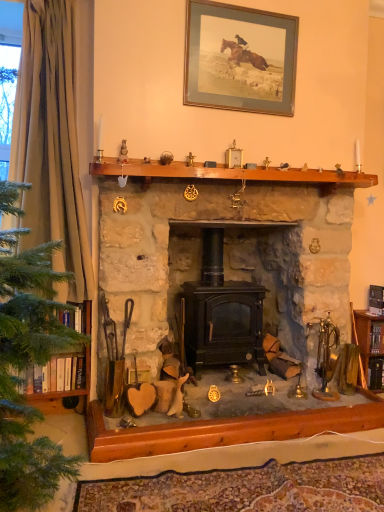
Question: Is green fabric curtain at left next to brown wooden mantle at upper center?

Choices:
 (A) no
 (B) yes

Answer: (A)

Question: Is green fabric curtain at left to the left of brown wooden mantle at upper center from the viewer's perspective?

Choices:
 (A) no
 (B) yes

Answer: (B)

Question: Considering the relative positions of green fabric curtain at left and brown wooden mantle at upper center in the image provided, is green fabric curtain at left behind brown wooden mantle at upper center?

Choices:
 (A) no
 (B) yes

Answer: (A)

Question: Is green fabric curtain at left shorter than brown wooden mantle at upper center?

Choices:
 (A) yes
 (B) no

Answer: (B)

Question: Is green fabric curtain at left positioned with its back to brown wooden mantle at upper center?

Choices:
 (A) yes
 (B) no

Answer: (B)

Question: Based on their positions, is matte black wood-burning stove at center located to the left or right of brown wooden mantle at upper center?

Choices:
 (A) left
 (B) right

Answer: (A)

Question: Does point (124, 223) appear closer or farther from the camera than point (240, 167)?

Choices:
 (A) closer
 (B) farther

Answer: (A)

Question: From a real-world perspective, relative to brown wooden mantle at upper center, is matte black wood-burning stove at center vertically above or below?

Choices:
 (A) above
 (B) below

Answer: (B)

Question: Is matte black wood-burning stove at center taller or shorter than brown wooden mantle at upper center?

Choices:
 (A) tall
 (B) short

Answer: (A)

Question: Is matte black wood-burning stove at center spatially inside gold-framed print at upper center, or outside of it?

Choices:
 (A) outside
 (B) inside

Answer: (A)

Question: Looking at the image, does matte black wood-burning stove at center seem bigger or smaller compared to gold-framed print at upper center?

Choices:
 (A) small
 (B) big

Answer: (B)

Question: Does point (339, 242) appear closer or farther from the camera than point (286, 95)?

Choices:
 (A) closer
 (B) farther

Answer: (B)

Question: Considering the positions of matte black wood-burning stove at center and gold-framed print at upper center in the image, is matte black wood-burning stove at center wider or thinner than gold-framed print at upper center?

Choices:
 (A) thin
 (B) wide

Answer: (B)

Question: Do you think brown wooden mantle at upper center is within green fabric curtain at left, or outside of it?

Choices:
 (A) outside
 (B) inside

Answer: (A)

Question: Considering the positions of point (221, 177) and point (36, 229), is point (221, 177) closer or farther from the camera than point (36, 229)?

Choices:
 (A) closer
 (B) farther

Answer: (B)